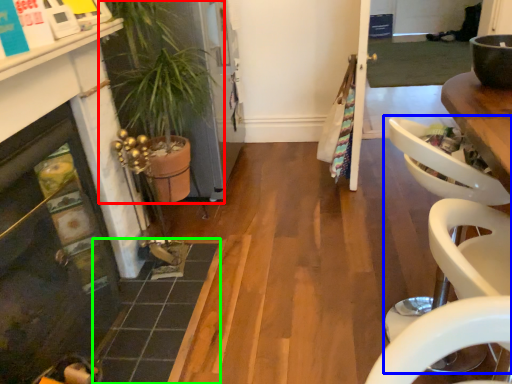
Question: Which object is positioned closest to houseplant (highlighted by a red box)? Select from armchair (highlighted by a blue box) and tile (highlighted by a green box).

Choices:
 (A) armchair
 (B) tile

Answer: (B)